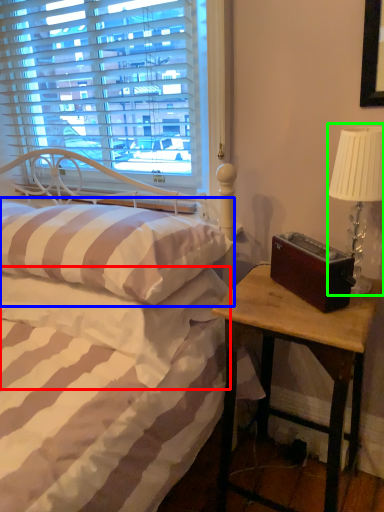
Question: Considering the real-world distances, which object is farthest from mattress (highlighted by a red box)? pillow (highlighted by a blue box) or table lamp (highlighted by a green box)?

Choices:
 (A) pillow
 (B) table lamp

Answer: (B)